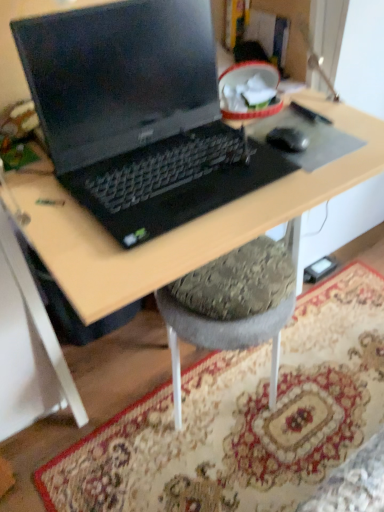
Question: Is black plastic desk at center positioned beyond the bounds of black matte mousepad at center?

Choices:
 (A) yes
 (B) no

Answer: (A)

Question: Is black plastic desk at center aimed at black matte mousepad at center?

Choices:
 (A) yes
 (B) no

Answer: (A)

Question: Is black matte mousepad at center at the back of black plastic desk at center?

Choices:
 (A) no
 (B) yes

Answer: (B)

Question: Is black plastic desk at center closer to the viewer compared to black matte mousepad at center?

Choices:
 (A) no
 (B) yes

Answer: (B)

Question: Considering the relative positions of black plastic desk at center and black matte mousepad at center in the image provided, is black plastic desk at center to the left of black matte mousepad at center from the viewer's perspective?

Choices:
 (A) no
 (B) yes

Answer: (B)

Question: Is black plastic desk at center inside the boundaries of black rubber mouse at right, or outside?

Choices:
 (A) inside
 (B) outside

Answer: (B)

Question: From the image's perspective, relative to black rubber mouse at right, is black plastic desk at center above or below?

Choices:
 (A) below
 (B) above

Answer: (A)

Question: Considering the relative positions of black plastic desk at center and black rubber mouse at right in the image provided, is black plastic desk at center to the left or to the right of black rubber mouse at right?

Choices:
 (A) left
 (B) right

Answer: (A)

Question: Looking at their shapes, would you say black plastic desk at center is wider or thinner than black rubber mouse at right?

Choices:
 (A) wide
 (B) thin

Answer: (A)

Question: Does point (375, 426) appear closer or farther from the camera than point (311, 138)?

Choices:
 (A) closer
 (B) farther

Answer: (B)

Question: Is carpeted rug at lower center to the left or to the right of black matte mousepad at center in the image?

Choices:
 (A) left
 (B) right

Answer: (B)

Question: Looking at their shapes, would you say carpeted rug at lower center is wider or thinner than black matte mousepad at center?

Choices:
 (A) thin
 (B) wide

Answer: (B)

Question: From a real-world perspective, is carpeted rug at lower center above or below black matte mousepad at center?

Choices:
 (A) below
 (B) above

Answer: (A)

Question: Based on their positions, is black rubber mouse at right located to the left or right of black matte mousepad at center?

Choices:
 (A) right
 (B) left

Answer: (B)

Question: From a real-world perspective, is black rubber mouse at right positioned above or below black matte mousepad at center?

Choices:
 (A) below
 (B) above

Answer: (B)